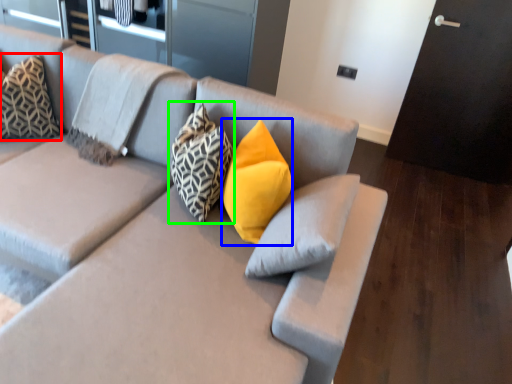
Question: Which is nearer to the pillow (highlighted by a red box)? pillow (highlighted by a blue box) or pillow (highlighted by a green box).

Choices:
 (A) pillow
 (B) pillow

Answer: (B)